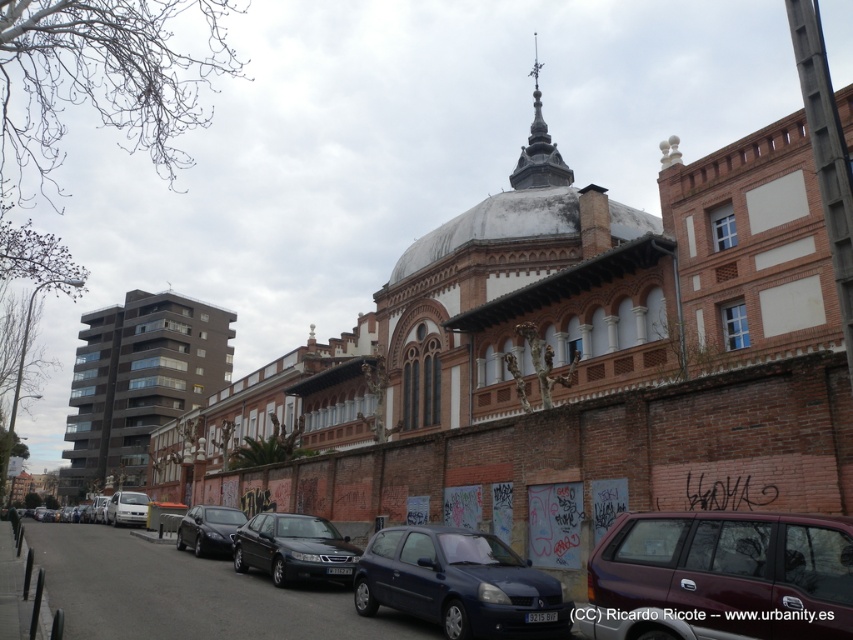
You are a photographer trying to capture the dark gray stone spire at upper center and the shiny black sedan at center in the same frame. Based on their sizes, which object should you focus on first to ensure both are clearly visible in your photo?

The dark gray stone spire at upper center is larger in size than the shiny black sedan at center, so you should focus on the dark gray stone spire at upper center first to ensure both are clearly visible in your photo.

You are standing on the street looking at the historical building. There are two points marked on the image. The first point is at coordinates point (190, 528) and the second is at point (137, 500). Which point is closer to you?

Point (190, 528) is closer to the viewer than point (137, 500).

You are a delivery driver who needs to park your truck, which is 7 meters long, in this street scene. You see the shiny black sedan at center and the white matte van at lower left. Can you estimate if there is enough space between these two vehicles to park your truck?

The shiny black sedan at center is larger in size than the white matte van at lower left, but without knowing the exact distance between them or the total available space, it is impossible to determine if there is enough room for a 7 meter long truck. Additional information about the spacing between the vehicles is required.